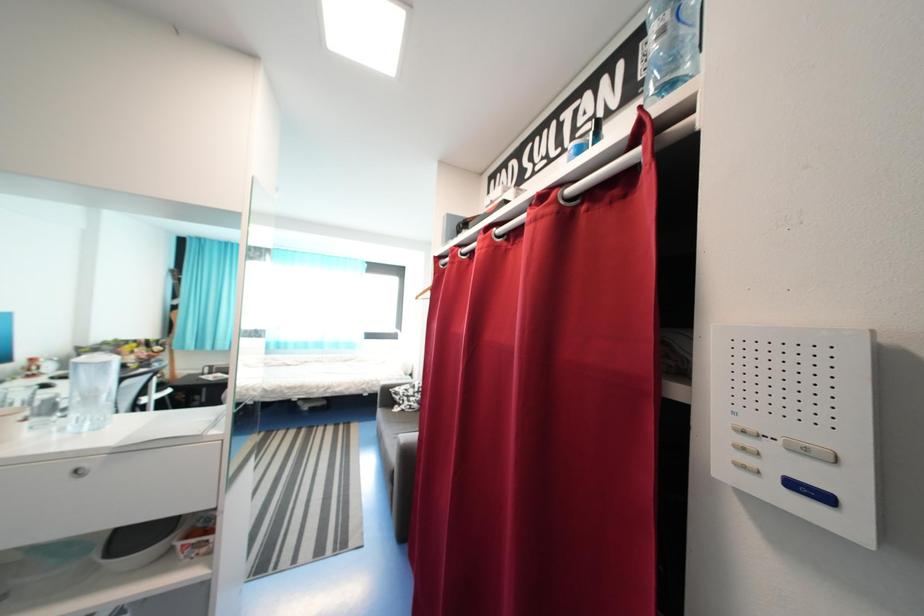
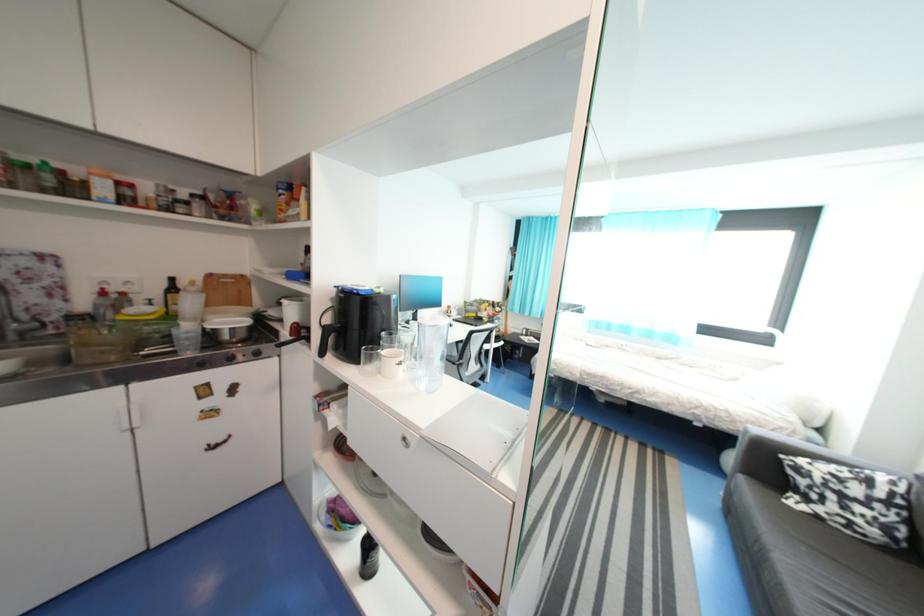
Question: The first image is from the beginning of the video and the second image is from the end. How did the camera likely rotate when shooting the video?

Choices:
 (A) Left
 (B) Right
 (C) Up
 (D) Down

Answer: (A)